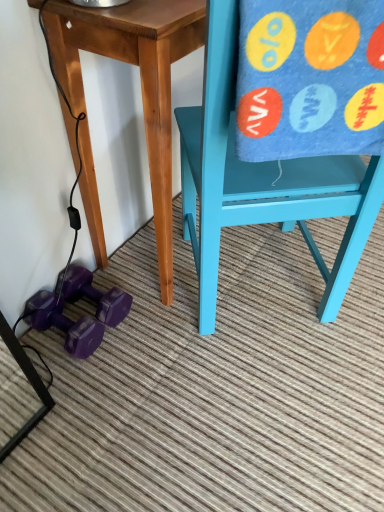
Identify the location of vacant area on the back side of purple rubber dumbbell at lower left, which is the 2th dumbbell in bottom-to-top order. The height and width of the screenshot is (512, 384). (124, 266).